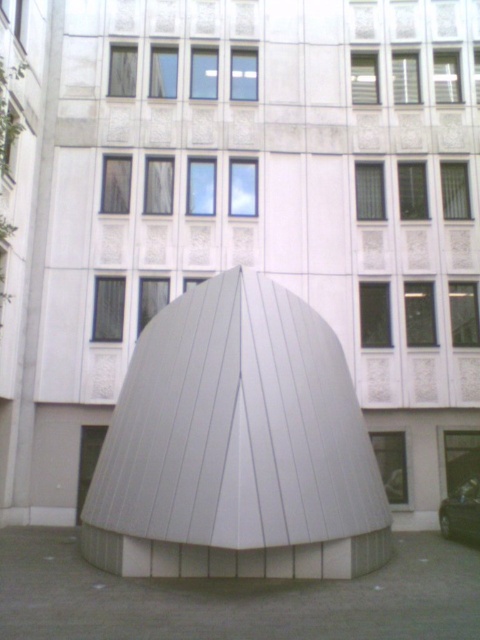
Can you confirm if white smooth dome at center is positioned to the left of shiny black car at lower right?

Yes, white smooth dome at center is to the left of shiny black car at lower right.

Between white smooth dome at center and shiny black car at lower right, which one appears on the right side from the viewer's perspective?

shiny black car at lower right is more to the right.

You are a GUI agent. You are given a task and a screenshot of the screen. Output one action in this format:
    pyautogui.click(x=<x>, y=<y>)
    Task: Click on the white smooth dome at center
    
    Given the screenshot: What is the action you would take?
    pyautogui.click(x=237, y=428)

Locate an element on the screen. white smooth dome at center is located at coordinates (237, 428).